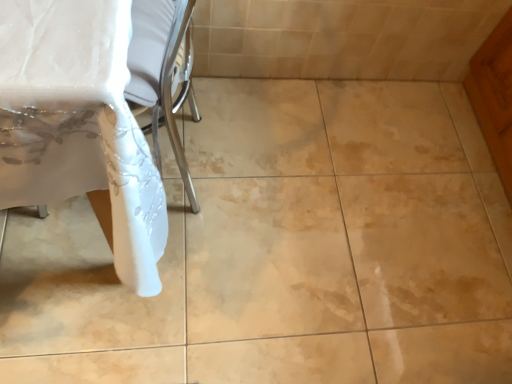
Describe the element at coordinates (164, 69) in the screenshot. I see `white fabric tablecloth at left` at that location.

You are a GUI agent. You are given a task and a screenshot of the screen. Output one action in this format:
    pyautogui.click(x=<x>, y=<y>)
    Task: Click on the white fabric tablecloth at left
    Image resolution: width=512 pixels, height=384 pixels.
    Given the screenshot: What is the action you would take?
    coord(164,69)

Identify the location of white fabric tablecloth at left. This screenshot has height=384, width=512. (164, 69).